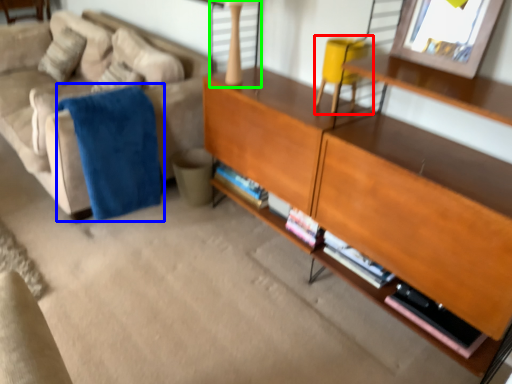
Question: Which object is positioned closest to swivel chair (highlighted by a red box)? Select from blanket (highlighted by a blue box) and table lamp (highlighted by a green box).

Choices:
 (A) blanket
 (B) table lamp

Answer: (B)